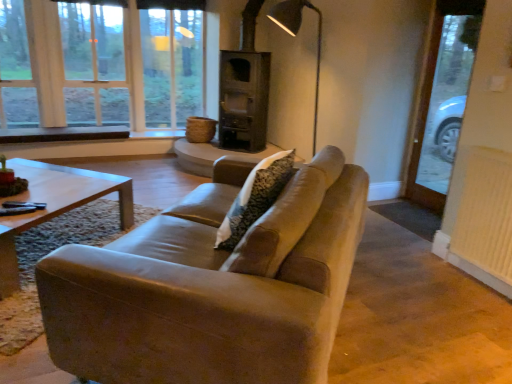
Question: Is metallic gray floor lamp at upper center completely or partially inside clear glass door at right?

Choices:
 (A) no
 (B) yes

Answer: (A)

Question: From the image's perspective, is clear glass door at right beneath metallic gray floor lamp at upper center?

Choices:
 (A) yes
 (B) no

Answer: (A)

Question: Is there a large distance between clear glass door at right and metallic gray floor lamp at upper center?

Choices:
 (A) yes
 (B) no

Answer: (A)

Question: Is clear glass door at right shorter than metallic gray floor lamp at upper center?

Choices:
 (A) no
 (B) yes

Answer: (A)

Question: Is clear glass door at right facing away from metallic gray floor lamp at upper center?

Choices:
 (A) no
 (B) yes

Answer: (A)

Question: Is metallic gray floor lamp at upper center spatially inside clear glass window at upper left, or outside of it?

Choices:
 (A) outside
 (B) inside

Answer: (A)

Question: Is metallic gray floor lamp at upper center bigger or smaller than clear glass window at upper left?

Choices:
 (A) big
 (B) small

Answer: (B)

Question: Considering the positions of point (298, 11) and point (92, 107), is point (298, 11) closer or farther from the camera than point (92, 107)?

Choices:
 (A) farther
 (B) closer

Answer: (B)

Question: From a real-world perspective, is metallic gray floor lamp at upper center physically located above or below clear glass window at upper left?

Choices:
 (A) above
 (B) below

Answer: (B)

Question: Considering the positions of point (91, 264) and point (424, 105), is point (91, 264) closer or farther from the camera than point (424, 105)?

Choices:
 (A) closer
 (B) farther

Answer: (A)

Question: Would you say leather couch at center is to the left or to the right of clear glass door at right in the picture?

Choices:
 (A) left
 (B) right

Answer: (A)

Question: Is leather couch at center in front of or behind clear glass door at right in the image?

Choices:
 (A) front
 (B) behind

Answer: (A)

Question: From a real-world perspective, is leather couch at center positioned above or below clear glass door at right?

Choices:
 (A) below
 (B) above

Answer: (A)

Question: Considering the positions of point (466, 56) and point (317, 39), is point (466, 56) closer or farther from the camera than point (317, 39)?

Choices:
 (A) farther
 (B) closer

Answer: (B)

Question: From a real-world perspective, relative to metallic gray floor lamp at upper center, is clear glass door at right vertically above or below?

Choices:
 (A) above
 (B) below

Answer: (B)